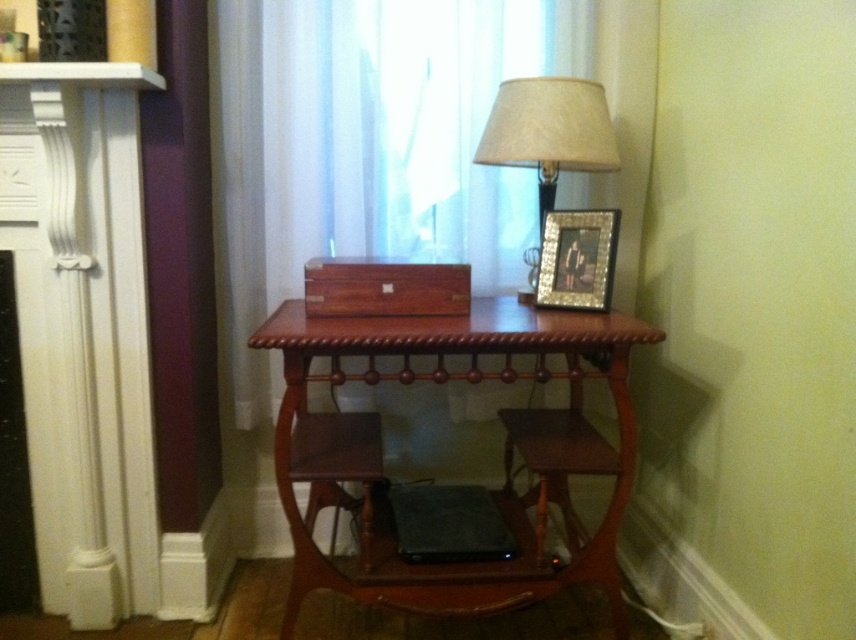
Consider the image. You are organizing a small party and want to place a decorative vase between the translucent fabric curtain at upper center and the gold textured picture frame at upper right. Based on their positions, where should you place the vase?

The translucent fabric curtain at upper center is positioned on the left side of the gold textured picture frame at upper right, so you should place the vase between them, ensuring it is centered between the two objects.

You are trying to hang a new painting that requires a hook placed above the mahogany wood table at center. The translucent fabric curtain at upper center is already hanging there. Can the painting be hung above the table without moving the curtain?

The translucent fabric curtain at upper center is much taller than the mahogany wood table at center, so there might not be enough space above the table to hang the painting without overlapping the curtain.

You are organizing a study space and need to place a new book on the mahogany wood table at center. However, you want to ensure it won not block the light from the matte beige fabric lampshade at upper right. Based on their positions, is this possible?

The mahogany wood table at center is below the matte beige fabric lampshade at upper right, so placing the book on the table will not block the light from the lampshade since the table is positioned lower.